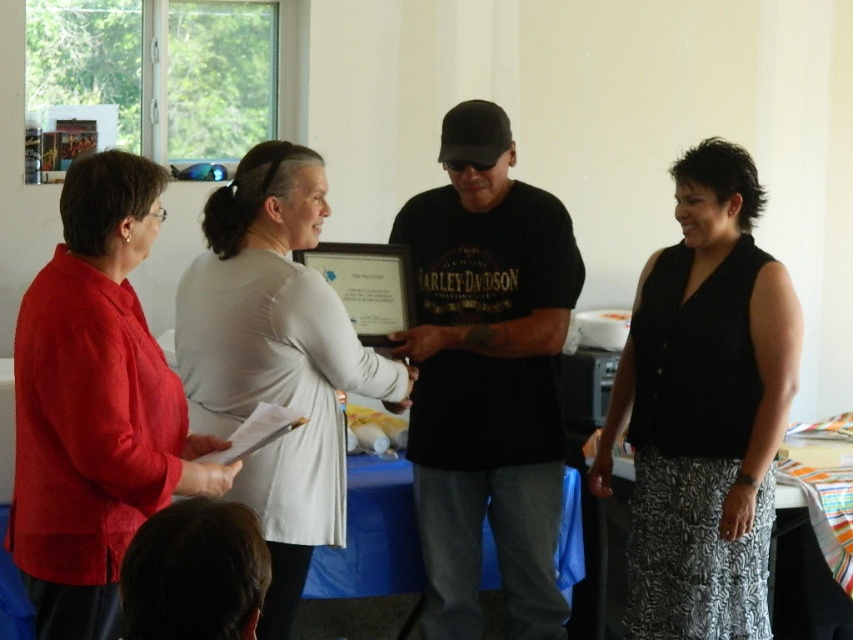
Who is shorter, black knit vest at right or matte red blouse at left?

matte red blouse at left

Locate an element on the screen. This screenshot has height=640, width=853. black knit vest at right is located at coordinates (703, 410).

Describe the element at coordinates (703, 410) in the screenshot. I see `black knit vest at right` at that location.

You are a GUI agent. You are given a task and a screenshot of the screen. Output one action in this format:
    pyautogui.click(x=<x>, y=<y>)
    Task: Click on the black knit vest at right
    Image resolution: width=853 pixels, height=640 pixels.
    Given the screenshot: What is the action you would take?
    pos(703,410)

Between black matte t-shirt at center and black knit vest at right, which one has more height?

black matte t-shirt at center is taller.

Can you confirm if black matte t-shirt at center is smaller than black knit vest at right?

Indeed, black matte t-shirt at center has a smaller size compared to black knit vest at right.

Is point (570, 308) more distant than point (692, 182)?

That is True.

Find the location of a particular element. The height and width of the screenshot is (640, 853). black matte t-shirt at center is located at coordinates (486, 378).

Is black matte t-shirt at center thinner than white fabric at center?

Indeed, black matte t-shirt at center has a lesser width compared to white fabric at center.

Locate an element on the screen. The image size is (853, 640). black matte t-shirt at center is located at coordinates (486, 378).

Which is behind, point (500, 244) or point (195, 401)?

The point (500, 244) is more distant.

In order to click on black matte t-shirt at center in this screenshot , I will do `click(486, 378)`.